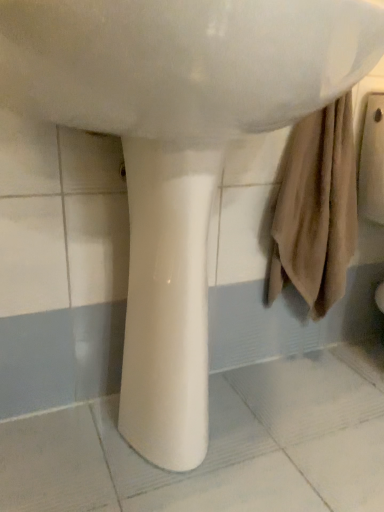
Question: Can you confirm if white glossy sink at center is shorter than white glossy pedestal at center?

Choices:
 (A) no
 (B) yes

Answer: (B)

Question: Can you confirm if white glossy sink at center is wider than white glossy pedestal at center?

Choices:
 (A) no
 (B) yes

Answer: (B)

Question: From a real-world perspective, is white glossy sink at center on white glossy pedestal at center?

Choices:
 (A) yes
 (B) no

Answer: (A)

Question: From a real-world perspective, is white glossy sink at center beneath white glossy pedestal at center?

Choices:
 (A) no
 (B) yes

Answer: (A)

Question: Is white glossy sink at center not close to white glossy pedestal at center?

Choices:
 (A) yes
 (B) no

Answer: (B)

Question: Is the depth of white glossy sink at center greater than that of white glossy pedestal at center?

Choices:
 (A) yes
 (B) no

Answer: (B)

Question: Considering the relative positions of white glossy pedestal at center and white glossy sink at center in the image provided, is white glossy pedestal at center to the right of white glossy sink at center from the viewer's perspective?

Choices:
 (A) yes
 (B) no

Answer: (B)

Question: From a real-world perspective, is white glossy pedestal at center positioned over white glossy sink at center based on gravity?

Choices:
 (A) yes
 (B) no

Answer: (B)

Question: Can you confirm if white glossy pedestal at center is smaller than white glossy sink at center?

Choices:
 (A) yes
 (B) no

Answer: (A)

Question: From a real-world perspective, is white glossy pedestal at center positioned under white glossy sink at center based on gravity?

Choices:
 (A) no
 (B) yes

Answer: (B)

Question: Can you confirm if white glossy pedestal at center is thinner than white glossy sink at center?

Choices:
 (A) yes
 (B) no

Answer: (A)

Question: Is white glossy pedestal at center taller than white glossy sink at center?

Choices:
 (A) no
 (B) yes

Answer: (B)

Question: From a real-world perspective, is white glossy pedestal at center above or below white glossy sink at center?

Choices:
 (A) above
 (B) below

Answer: (B)